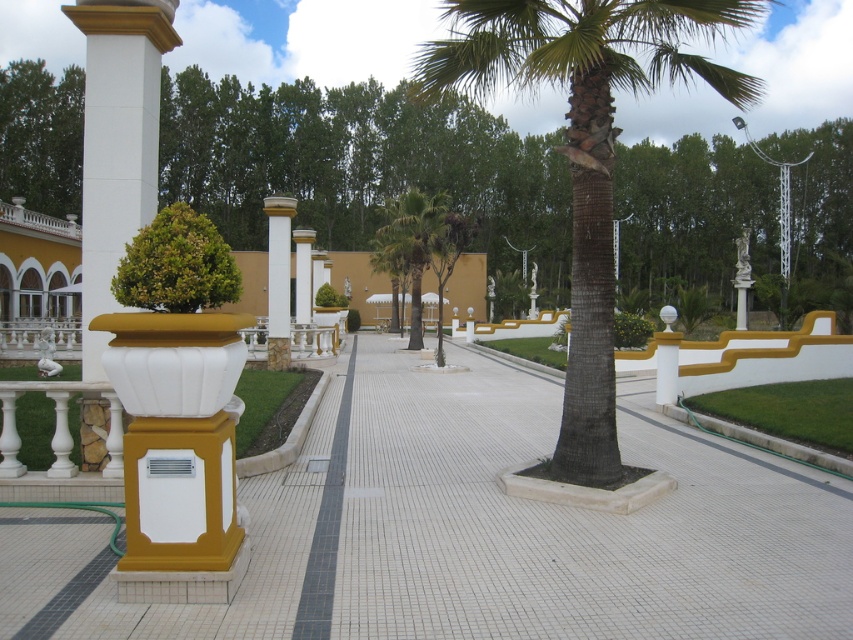
In the scene shown: You are designing a garden layout and need to place a bench between the white glossy column at left and the green leafy palm tree at center. Which object should the bench be closer to if you want it to be equidistant from both but aligned with the wider object?

The bench should be closer to the green leafy palm tree at center because the white glossy column at left is wider. To maintain equal distance from both, the bench must be positioned nearer to the narrower object, which is the palm tree.

You are standing at the entrance of the resort and see the white marble column at center and the white glossy pillar at center. Which one is nearer to you?

The white marble column at center is closer to the viewer than the white glossy pillar at center.